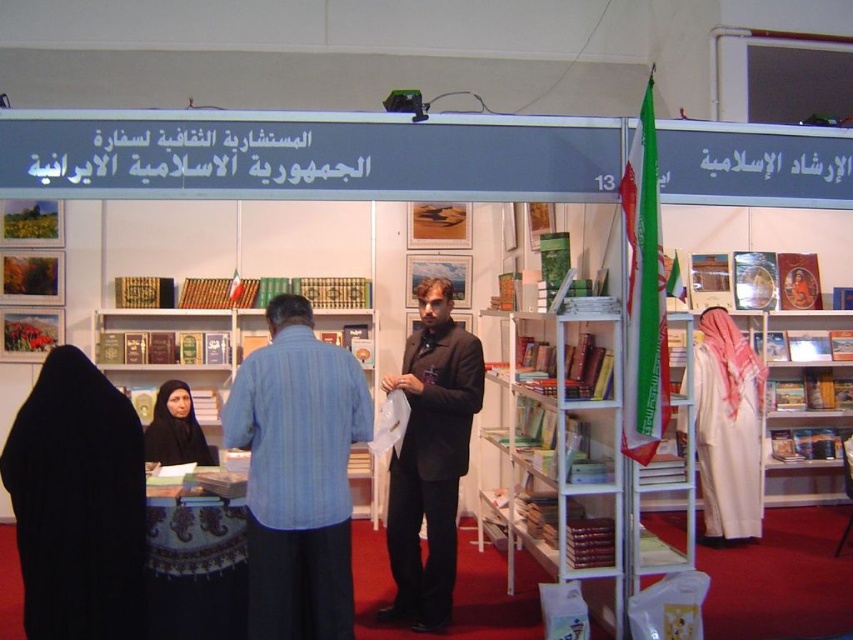
Does white metal bookshelf at center appear on the left side of matte black suit at center?

Incorrect, white metal bookshelf at center is not on the left side of matte black suit at center.

Is the position of white metal bookshelf at center less distant than that of matte black suit at center?

That is True.

In order to click on white metal bookshelf at center in this screenshot , I will do `click(576, 461)`.

I want to click on white metal bookshelf at center, so click(x=576, y=461).

From the picture: Is white metal bookshelf at center closer to camera compared to white paper at center?

Yes, white metal bookshelf at center is in front of white paper at center.

Is white metal bookshelf at center further to the viewer compared to white paper at center?

No, white metal bookshelf at center is closer to the viewer.

Between point (619, 534) and point (209, 324), which one is positioned behind?

The point (209, 324) is more distant.

Locate an element on the screen. white metal bookshelf at center is located at coordinates click(576, 461).

Consider the image. Does matte black suit at center have a greater height compared to black fabric headscarf at center?

Indeed, matte black suit at center has a greater height compared to black fabric headscarf at center.

How much distance is there between matte black suit at center and black fabric headscarf at center?

matte black suit at center is 1.22 meters away from black fabric headscarf at center.

This screenshot has width=853, height=640. Identify the location of matte black suit at center. (430, 458).